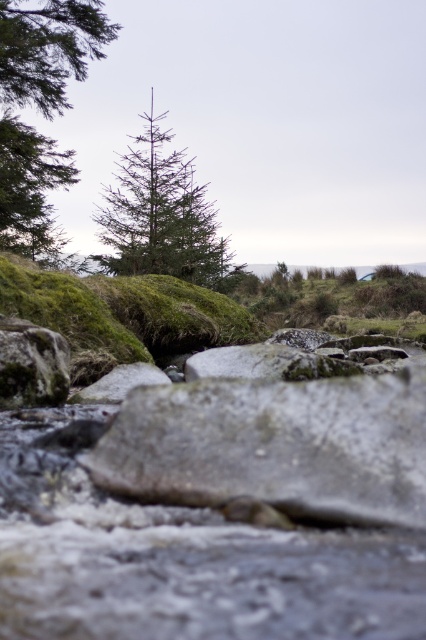
Does green matte tree at upper left have a greater width compared to green matte tree at center?

No.

Can you confirm if green matte tree at upper left is positioned to the left of green matte tree at center?

Indeed, green matte tree at upper left is positioned on the left side of green matte tree at center.

Does point (2, 132) come in front of point (178, 236)?

Yes, it is.

This screenshot has width=426, height=640. I want to click on green matte tree at upper left, so click(40, 108).

Who is more forward, (230, 449) or (65, 364)?

Point (230, 449) is more forward.

From the picture: Does gray rough boulder at center appear on the left side of gray rough rock at lower left?

In fact, gray rough boulder at center is to the right of gray rough rock at lower left.

Image resolution: width=426 pixels, height=640 pixels. Find the location of `gray rough boulder at center`. gray rough boulder at center is located at coordinates (275, 445).

Is green matte tree at center behind gray rough rock at lower left?

Yes, green matte tree at center is further from the viewer.

Between point (230, 257) and point (66, 355), which one is positioned behind?

The point (230, 257) is behind.

Locate an element on the screen. The image size is (426, 640). green matte tree at center is located at coordinates (161, 218).